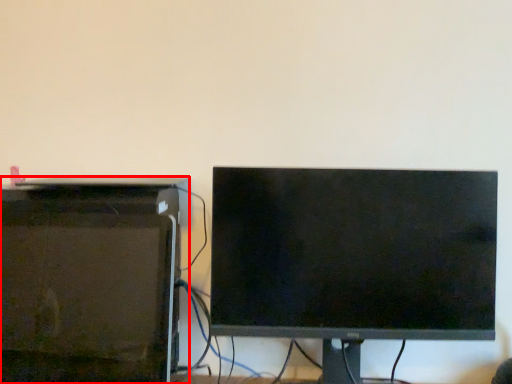
Question: Observing the image, what is the correct spatial positioning of desktop computer (annotated by the red box) in reference to computer monitor?

Choices:
 (A) right
 (B) left

Answer: (B)